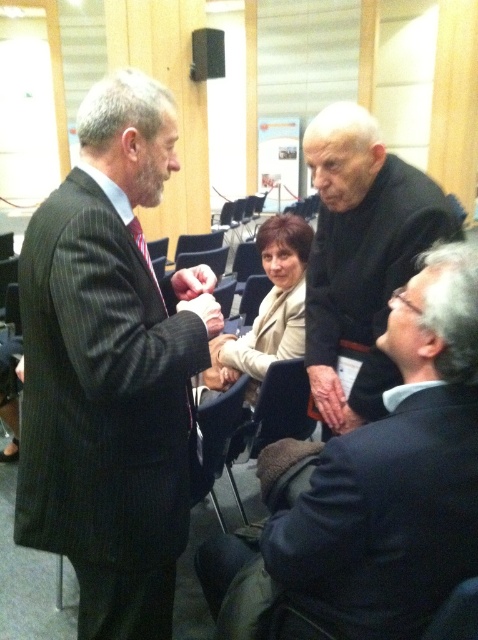
You are a photographer in the conference room. You need to capture a handshake between the dry skin hand at lower center and the matte black hand at center. Since the hands are different sizes, which hand will appear smaller in the photo?

The dry skin hand at lower center has a smaller size compared to the matte black hand at center, so it will appear smaller in the photo.

Please describe the exact location of the dry skin hand at lower center in the image using coordinates. The scene shows a formal indoor setting with two men shaking hands in the foreground. You must use the provided coordinates to answer.

The dry skin hand at lower center is located at coordinates point (327, 396).

You are a photographer positioned at the back of the room. You want to take a photo of the black matte suit at upper right and the matte black hand at center so that both are in focus. The camera you are using has a depth of field that can sharply focus on objects within 18 inches of each other. Will both subjects be in focus?

The black matte suit at upper right and matte black hand at center are 19.25 inches apart. Since the distance between them exceeds the camera s 18 inch depth of field range, the two subjects will not both be in focus in the photo.